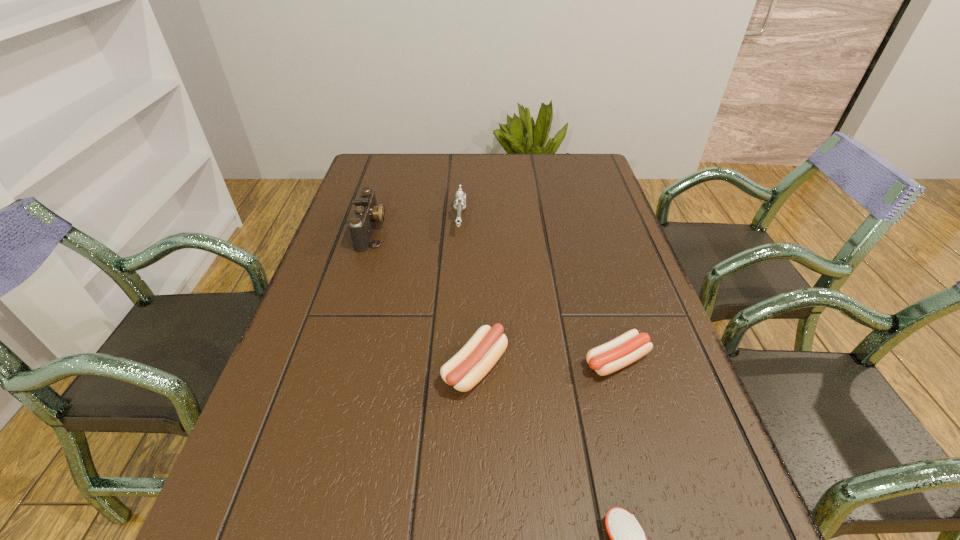
This screenshot has width=960, height=540. In order to click on object that is at the left edge in this screenshot , I will do `click(366, 213)`.

I want to click on object present at the right edge, so coord(620,352).

Where is `vacant space at the far edge`? The height and width of the screenshot is (540, 960). vacant space at the far edge is located at coordinates (424, 176).

Where is `free region at the left edge of the desktop`? This screenshot has width=960, height=540. free region at the left edge of the desktop is located at coordinates coord(342,242).

Locate an element on the screen. Image resolution: width=960 pixels, height=540 pixels. vacant space at the right edge of the desktop is located at coordinates (658, 477).

This screenshot has width=960, height=540. Identify the location of vacant space at the far left corner of the desktop. (387, 172).

Identify the location of unoccupied position between the gun and the left sausage. This screenshot has width=960, height=540. (468, 293).

Where is `empty space that is in between the second shortest object and the left sausage`? empty space that is in between the second shortest object and the left sausage is located at coordinates (546, 364).

Image resolution: width=960 pixels, height=540 pixels. Find the location of `unoccupied position between the leftmost object and the left sausage`. unoccupied position between the leftmost object and the left sausage is located at coordinates (423, 299).

Image resolution: width=960 pixels, height=540 pixels. What are the coordinates of `free space that is in between the leftmost object and the shorter sausage` in the screenshot? It's located at (494, 295).